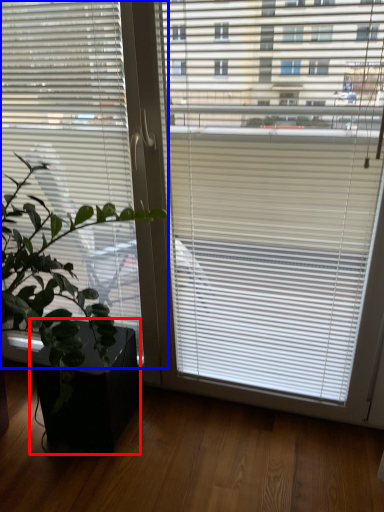
Question: Which of the following is the closest to the observer, flowerpot (highlighted by a red box) or window blind (highlighted by a blue box)?

Choices:
 (A) flowerpot
 (B) window blind

Answer: (B)